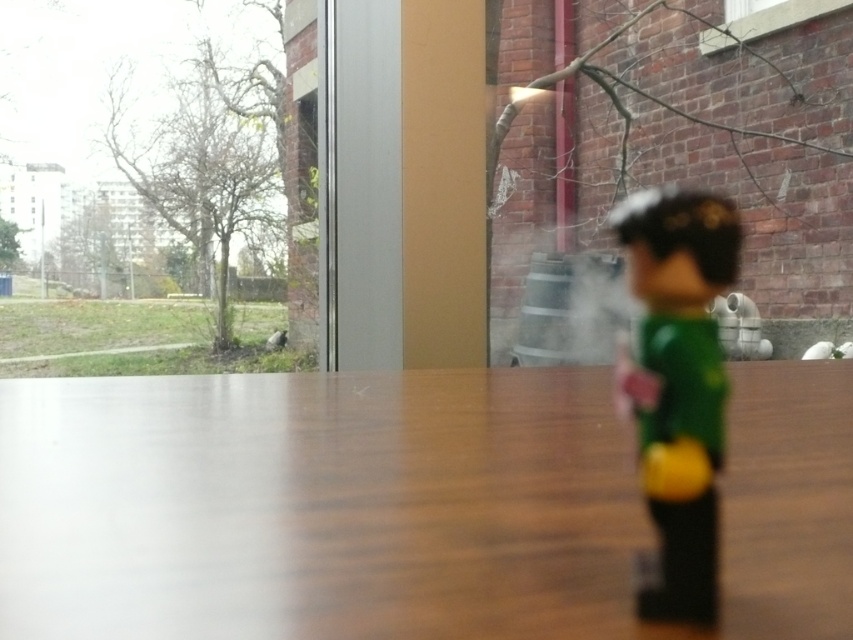
Question: Is wooden table at center wider than green matte toy at right?

Choices:
 (A) no
 (B) yes

Answer: (B)

Question: Which object is farther from the camera taking this photo?

Choices:
 (A) green matte toy at right
 (B) wooden table at center

Answer: (A)

Question: Which point is farther from the camera taking this photo?

Choices:
 (A) (471, 381)
 (B) (636, 410)

Answer: (A)

Question: Does wooden table at center come in front of green matte toy at right?

Choices:
 (A) yes
 (B) no

Answer: (A)

Question: Which point is closer to the camera?

Choices:
 (A) (144, 467)
 (B) (723, 376)

Answer: (A)

Question: Is wooden table at center to the left of green matte toy at right from the viewer's perspective?

Choices:
 (A) no
 (B) yes

Answer: (B)